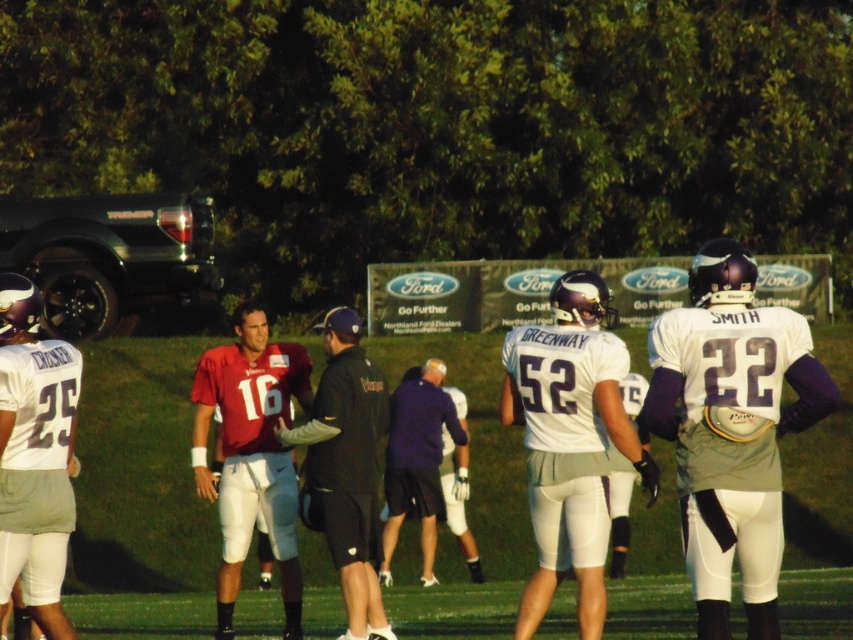
You are a photographer standing at the edge of the field. You want to take a photo that includes both the white matte jersey at center and the dark blue uniform at center. The camera you are using has a maximum focus range of 1.8 meters. Will both subjects be in focus?

The distance between the white matte jersey at center and the dark blue uniform at center is 1.76 meters, which is within the camera maximum focus range of 1.8 meters. Thus, both subjects will be in focus.